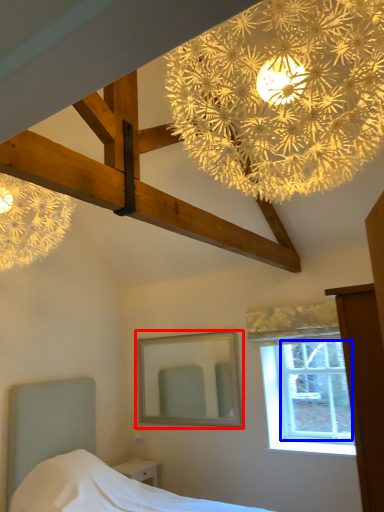
Question: Which of the following is the closest to the observer, mirror (highlighted by a red box) or window screen (highlighted by a blue box)?

Choices:
 (A) mirror
 (B) window screen

Answer: (B)